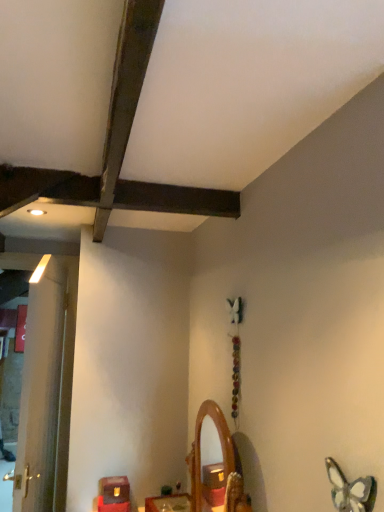
Describe the element at coordinates (350, 490) in the screenshot. I see `translucent glass butterfly at lower right` at that location.

This screenshot has width=384, height=512. What do you see at coordinates (200, 448) in the screenshot?
I see `wooden mirror at center` at bounding box center [200, 448].

What is the approximate width of wooden mirror at center?

wooden mirror at center is 5.11 inches wide.

This screenshot has width=384, height=512. Describe the element at coordinates (40, 394) in the screenshot. I see `white wood door at left` at that location.

This screenshot has width=384, height=512. What do you see at coordinates (114, 494) in the screenshot? I see `matte brown wooden box at lower left, the 1th furniture from the left` at bounding box center [114, 494].

Find the location of a particular element. translucent glass butterfly at lower right is located at coordinates (350, 490).

Considering the sizes of objects white wood door at left and translucent glass butterfly at lower right in the image provided, who is thinner, white wood door at left or translucent glass butterfly at lower right?

With smaller width is translucent glass butterfly at lower right.

Is white wood door at left in contact with translucent glass butterfly at lower right?

There is a gap between white wood door at left and translucent glass butterfly at lower right.

From the image's perspective, is white wood door at left located above translucent glass butterfly at lower right?

No, from the image's perspective, white wood door at left is not above translucent glass butterfly at lower right.

From their relative heights in the image, would you say white wood door at left is taller or shorter than translucent glass butterfly at lower right?

In the image, white wood door at left appears to be taller than translucent glass butterfly at lower right.

Find the location of a particular element. This screenshot has height=512, width=384. mirror below the translucent glass butterfly at lower right (from a real-world perspective) is located at coordinates (200, 448).

Is wooden mirror at center to the left or to the right of translucent glass butterfly at lower right in the image?

Based on their positions, wooden mirror at center is located to the left of translucent glass butterfly at lower right.

From a real-world perspective, is wooden mirror at center over translucent glass butterfly at lower right?

Incorrect, from a real-world perspective, wooden mirror at center is lower than translucent glass butterfly at lower right.

Is point (196, 480) farther from camera compared to point (364, 510)?

That is True.

Locate an element on the screen. furniture above the matte brown wooden box at lower left, the second furniture in the right-to-left sequence (from the image's perspective) is located at coordinates (169, 503).

Are matte brown wooden box at lower left, the 1th furniture from the left, and wooden mirror at center, the second furniture when ordered from left to right, far apart?

No, matte brown wooden box at lower left, the 1th furniture from the left, is not far away from wooden mirror at center, the second furniture when ordered from left to right.

From the image's perspective, is matte brown wooden box at lower left, the 1th furniture from the left, over wooden mirror at center, the second furniture when ordered from left to right?

No, from the image's perspective, matte brown wooden box at lower left, the 1th furniture from the left, is not on top of wooden mirror at center, the second furniture when ordered from left to right.

Between matte brown wooden box at lower left, the 1th furniture from the left, and white wood door at left, which one has larger size?

white wood door at left is bigger.

This screenshot has height=512, width=384. There is a matte brown wooden box at lower left, the second furniture in the right-to-left sequence. What are the coordinates of `door above it (from a real-world perspective)` in the screenshot? It's located at (40, 394).

Considering the positions of points (105, 480) and (46, 303), is point (105, 480) farther from camera compared to point (46, 303)?

That is False.

Considering the relative positions of matte brown wooden box at lower left, the second furniture in the right-to-left sequence, and white wood door at left in the image provided, is matte brown wooden box at lower left, the second furniture in the right-to-left sequence, in front of white wood door at left?

No, matte brown wooden box at lower left, the second furniture in the right-to-left sequence, is behind white wood door at left.

Considering the sizes of objects matte brown wooden box at lower left, the 1th furniture from the left, and translucent glass butterfly at lower right in the image provided, who is smaller, matte brown wooden box at lower left, the 1th furniture from the left, or translucent glass butterfly at lower right?

translucent glass butterfly at lower right.

Where is `butterfly in front of the matte brown wooden box at lower left, the 1th furniture from the left`? butterfly in front of the matte brown wooden box at lower left, the 1th furniture from the left is located at coordinates (350, 490).

Which is closer to the camera, (125, 511) or (336, 483)?

The point (336, 483) is closer.

Which is further, (332,462) or (214,412)?

The point (214,412) is more distant.

Between translucent glass butterfly at lower right and wooden mirror at center, which one has smaller size?

Smaller between the two is translucent glass butterfly at lower right.

Between translucent glass butterfly at lower right and wooden mirror at center, which one has smaller width?

Thinner between the two is translucent glass butterfly at lower right.

From the image's perspective, is translucent glass butterfly at lower right above or below wooden mirror at center?

translucent glass butterfly at lower right is above wooden mirror at center.

Can you confirm if wooden mirror at center is shorter than wooden mirror at center, positioned as the first furniture in right-to-left order?

In fact, wooden mirror at center may be taller than wooden mirror at center, positioned as the first furniture in right-to-left order.

Does wooden mirror at center appear on the left side of wooden mirror at center, positioned as the first furniture in right-to-left order?

Incorrect, wooden mirror at center is not on the left side of wooden mirror at center, positioned as the first furniture in right-to-left order.

Is wooden mirror at center far away from wooden mirror at center, positioned as the first furniture in right-to-left order?

No, wooden mirror at center is not far from wooden mirror at center, positioned as the first furniture in right-to-left order.

From a real-world perspective, is wooden mirror at center positioned over wooden mirror at center, the second furniture when ordered from left to right, based on gravity?

Yes, from a real-world perspective, wooden mirror at center is on top of wooden mirror at center, the second furniture when ordered from left to right.

The image size is (384, 512). I want to click on door below the translucent glass butterfly at lower right (from the image's perspective), so click(40, 394).

Where is `mirror that is under the translucent glass butterfly at lower right (from a real-world perspective)`? This screenshot has width=384, height=512. mirror that is under the translucent glass butterfly at lower right (from a real-world perspective) is located at coordinates (200, 448).

Considering their positions, is white wood door at left positioned closer to wooden mirror at center than translucent glass butterfly at lower right?

translucent glass butterfly at lower right is closer to wooden mirror at center.

Considering their positions, is white wood door at left positioned closer to matte brown wooden box at lower left, the 1th furniture from the left, than translucent glass butterfly at lower right?

Based on the image, white wood door at left appears to be nearer to matte brown wooden box at lower left, the 1th furniture from the left.

Based on their spatial positions, is translucent glass butterfly at lower right or wooden mirror at center closer to matte brown wooden box at lower left, the 1th furniture from the left?

wooden mirror at center lies closer to matte brown wooden box at lower left, the 1th furniture from the left, than the other object.

Looking at the image, which one is located closer to white wood door at left, wooden mirror at center, positioned as the first furniture in right-to-left order, or translucent glass butterfly at lower right?

Based on the image, wooden mirror at center, positioned as the first furniture in right-to-left order, appears to be nearer to white wood door at left.

Estimate the real-world distances between objects in this image. Which object is closer to translucent glass butterfly at lower right, wooden mirror at center or matte brown wooden box at lower left, the second furniture in the right-to-left sequence?

wooden mirror at center.

Considering their positions, is white wood door at left positioned closer to wooden mirror at center than matte brown wooden box at lower left, the second furniture in the right-to-left sequence?

Among the two, matte brown wooden box at lower left, the second furniture in the right-to-left sequence, is located nearer to wooden mirror at center.

Based on their spatial positions, is white wood door at left or matte brown wooden box at lower left, the 1th furniture from the left, closer to wooden mirror at center, positioned as the first furniture in right-to-left order?

Based on the image, matte brown wooden box at lower left, the 1th furniture from the left, appears to be nearer to wooden mirror at center, positioned as the first furniture in right-to-left order.

Looking at this image, looking at the image, which one is located further to wooden mirror at center, the second furniture when ordered from left to right, matte brown wooden box at lower left, the 1th furniture from the left, or white wood door at left?

white wood door at left is further to wooden mirror at center, the second furniture when ordered from left to right.

The width and height of the screenshot is (384, 512). In order to click on mirror between white wood door at left and translucent glass butterfly at lower right in the horizontal direction in this screenshot , I will do `click(200, 448)`.

I want to click on door between translucent glass butterfly at lower right and matte brown wooden box at lower left, the second furniture in the right-to-left sequence, along the z-axis, so click(x=40, y=394).

The width and height of the screenshot is (384, 512). Identify the location of mirror between translucent glass butterfly at lower right and matte brown wooden box at lower left, the 1th furniture from the left, along the z-axis. (200, 448).

Image resolution: width=384 pixels, height=512 pixels. What are the coordinates of `furniture between translucent glass butterfly at lower right and matte brown wooden box at lower left, the 1th furniture from the left, in the front-back direction` in the screenshot? It's located at (169, 503).